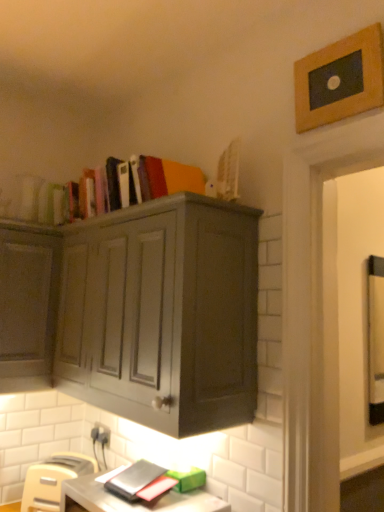
Question: From a real-world perspective, does matte gray desk at lower center sit lower than beige plastic toaster at lower left?

Choices:
 (A) no
 (B) yes

Answer: (A)

Question: Can you confirm if matte gray desk at lower center is wider than beige plastic toaster at lower left?

Choices:
 (A) yes
 (B) no

Answer: (A)

Question: Is matte gray desk at lower center further to the viewer compared to beige plastic toaster at lower left?

Choices:
 (A) no
 (B) yes

Answer: (A)

Question: Can you confirm if matte gray desk at lower center is shorter than beige plastic toaster at lower left?

Choices:
 (A) yes
 (B) no

Answer: (A)

Question: Considering the relative sizes of matte gray desk at lower center and beige plastic toaster at lower left in the image provided, is matte gray desk at lower center smaller than beige plastic toaster at lower left?

Choices:
 (A) yes
 (B) no

Answer: (B)

Question: Is point (54, 488) closer or farther from the camera than point (178, 504)?

Choices:
 (A) farther
 (B) closer

Answer: (A)

Question: Looking at their shapes, would you say beige plastic toaster at lower left is wider or thinner than matte gray desk at lower center?

Choices:
 (A) wide
 (B) thin

Answer: (B)

Question: In the image, is beige plastic toaster at lower left on the left side or the right side of matte gray desk at lower center?

Choices:
 (A) right
 (B) left

Answer: (B)

Question: Considering their positions, is beige plastic toaster at lower left located in front of or behind matte gray desk at lower center?

Choices:
 (A) behind
 (B) front

Answer: (A)

Question: From a real-world perspective, is white plastic electric outlet at lower left positioned above or below wooden picture frame at upper right?

Choices:
 (A) above
 (B) below

Answer: (B)

Question: In terms of width, does white plastic electric outlet at lower left look wider or thinner when compared to wooden picture frame at upper right?

Choices:
 (A) wide
 (B) thin

Answer: (B)

Question: Is white plastic electric outlet at lower left inside the boundaries of wooden picture frame at upper right, or outside?

Choices:
 (A) inside
 (B) outside

Answer: (B)

Question: Is white plastic electric outlet at lower left taller or shorter than wooden picture frame at upper right?

Choices:
 (A) short
 (B) tall

Answer: (A)

Question: Would you say beige plastic toaster at lower left is to the left or to the right of matte gray cabinet at upper center in the picture?

Choices:
 (A) left
 (B) right

Answer: (A)

Question: Is beige plastic toaster at lower left in front of or behind matte gray cabinet at upper center in the image?

Choices:
 (A) behind
 (B) front

Answer: (A)